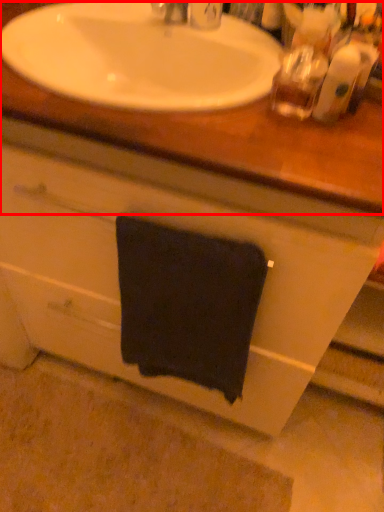
Question: From the image, what is the correct spatial relationship of counter top (annotated by the red box) in relation to towel/napkin?

Choices:
 (A) right
 (B) left

Answer: (B)